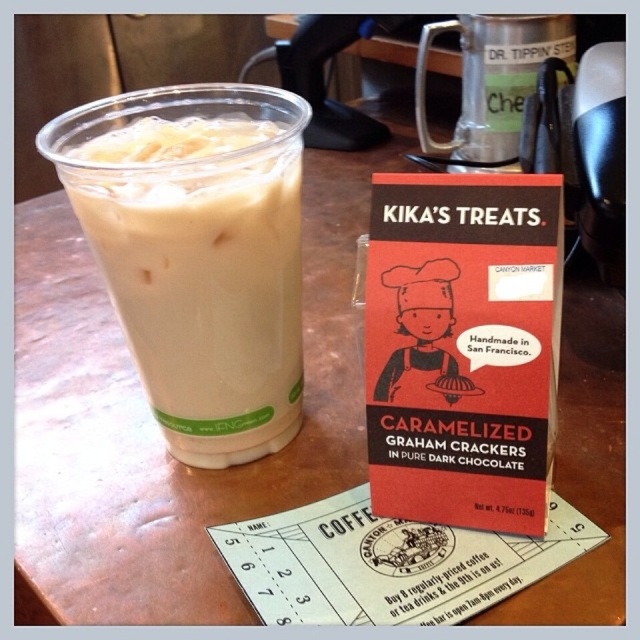
Question: Does white frothy milk at left appear on the left side of metallic silver cup at upper center?

Choices:
 (A) no
 (B) yes

Answer: (B)

Question: Is white frothy milk at left behind metallic silver cup at upper center?

Choices:
 (A) no
 (B) yes

Answer: (A)

Question: Which point is farther to the camera?

Choices:
 (A) metallic silver cup at upper center
 (B) white frothy milk at left

Answer: (A)

Question: Which object appears farthest from the camera in this image?

Choices:
 (A) white frothy milk at left
 (B) metallic silver cup at upper center

Answer: (B)

Question: Among these objects, which one is nearest to the camera?

Choices:
 (A) white frothy milk at left
 (B) metallic silver cup at upper center

Answer: (A)

Question: Is white frothy milk at left thinner than metallic silver cup at upper center?

Choices:
 (A) yes
 (B) no

Answer: (A)